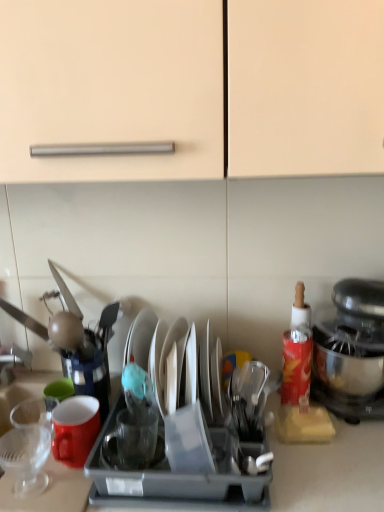
Question: Which direction should I rotate to face shiny silver plate at center, which is the third tableware from left to right, — up or down?

Choices:
 (A) down
 (B) up

Answer: (A)

Question: Can you confirm if metallic silver stand mixer at right is thinner than matte ceramic mug at left?

Choices:
 (A) no
 (B) yes

Answer: (A)

Question: Is metallic silver stand mixer at right positioned behind matte ceramic mug at left?

Choices:
 (A) yes
 (B) no

Answer: (A)

Question: Can you confirm if metallic silver stand mixer at right is bigger than matte ceramic mug at left?

Choices:
 (A) no
 (B) yes

Answer: (B)

Question: Is metallic silver stand mixer at right oriented towards matte ceramic mug at left?

Choices:
 (A) yes
 (B) no

Answer: (B)

Question: From the image's perspective, is metallic silver stand mixer at right beneath matte ceramic mug at left?

Choices:
 (A) yes
 (B) no

Answer: (B)

Question: From a real-world perspective, is metallic silver stand mixer at right positioned under matte ceramic mug at left based on gravity?

Choices:
 (A) no
 (B) yes

Answer: (A)

Question: Is transparent glass cup at left, marked as the third tableware in a right-to-left arrangement, wider than metallic silver stand mixer at right?

Choices:
 (A) yes
 (B) no

Answer: (B)

Question: Is transparent glass cup at left, placed as the 1th tableware when sorted from left to right, smaller than metallic silver stand mixer at right?

Choices:
 (A) no
 (B) yes

Answer: (B)

Question: From a real-world perspective, is transparent glass cup at left, marked as the third tableware in a right-to-left arrangement, below metallic silver stand mixer at right?

Choices:
 (A) yes
 (B) no

Answer: (A)

Question: Does transparent glass cup at left, marked as the third tableware in a right-to-left arrangement, appear on the right side of metallic silver stand mixer at right?

Choices:
 (A) yes
 (B) no

Answer: (B)

Question: Considering the relative positions of transparent glass cup at left, placed as the 1th tableware when sorted from left to right, and metallic silver stand mixer at right in the image provided, is transparent glass cup at left, placed as the 1th tableware when sorted from left to right, in front of metallic silver stand mixer at right?

Choices:
 (A) no
 (B) yes

Answer: (B)

Question: Is transparent glass cup at left, marked as the third tableware in a right-to-left arrangement, touching metallic silver stand mixer at right?

Choices:
 (A) yes
 (B) no

Answer: (B)

Question: Considering the relative sizes of shiny silver plate at center, which is the third tableware from left to right, and transparent glass cup at center, marked as the second tableware in a right-to-left arrangement, in the image provided, is shiny silver plate at center, which is the third tableware from left to right, thinner than transparent glass cup at center, marked as the second tableware in a right-to-left arrangement,?

Choices:
 (A) yes
 (B) no

Answer: (B)